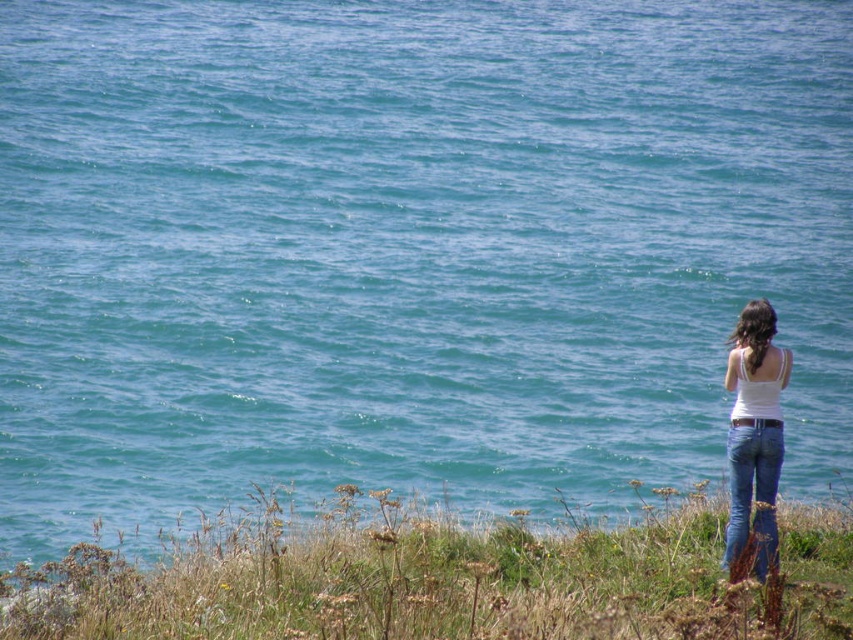
Question: Which of the following is the farthest from the observer?

Choices:
 (A) (769, 320)
 (B) (769, 429)

Answer: (A)

Question: Which of the following is the closest to the observer?

Choices:
 (A) (762, 310)
 (B) (779, 440)

Answer: (B)

Question: Which point is farther from the camera taking this photo?

Choices:
 (A) (775, 468)
 (B) (735, 385)

Answer: (B)

Question: Does white cotton tank top at right lie behind blue denim jeans at lower right?

Choices:
 (A) no
 (B) yes

Answer: (B)

Question: Can you confirm if white cotton tank top at right is positioned below blue denim jeans at lower right?

Choices:
 (A) no
 (B) yes

Answer: (A)

Question: Can you confirm if white cotton tank top at right is wider than blue denim jeans at lower right?

Choices:
 (A) yes
 (B) no

Answer: (A)